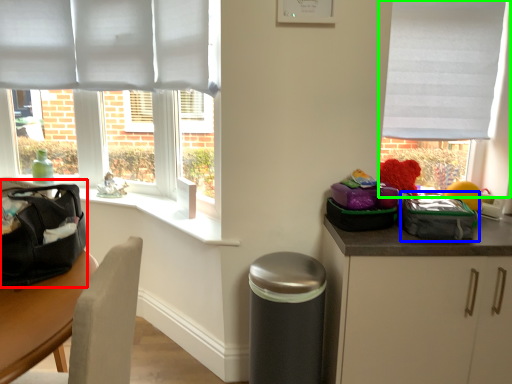
Question: Estimate the real-world distances between objects in this image. Which object is farther from pack (highlighted by a red box), kit (highlighted by a blue box) or window (highlighted by a green box)?

Choices:
 (A) kit
 (B) window

Answer: (B)